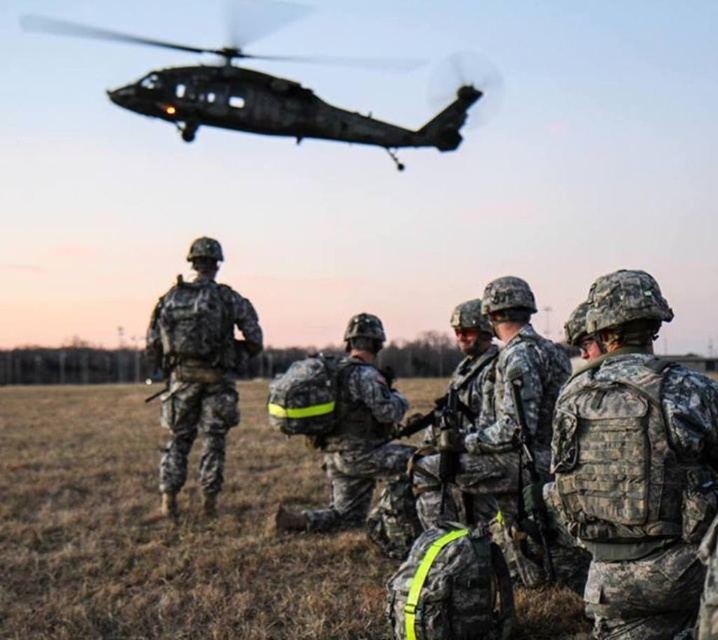
You are a photographer standing at the camera position. You want to capture a closeup shot of the camouflage fabric vest at center without moving the vest. Can you move closer to the vest to get a better shot?

The camouflage fabric vest at center is 2.82 meters away from the camera. Since you can move closer to the vest, you can reduce the distance to achieve a better closeup shot.